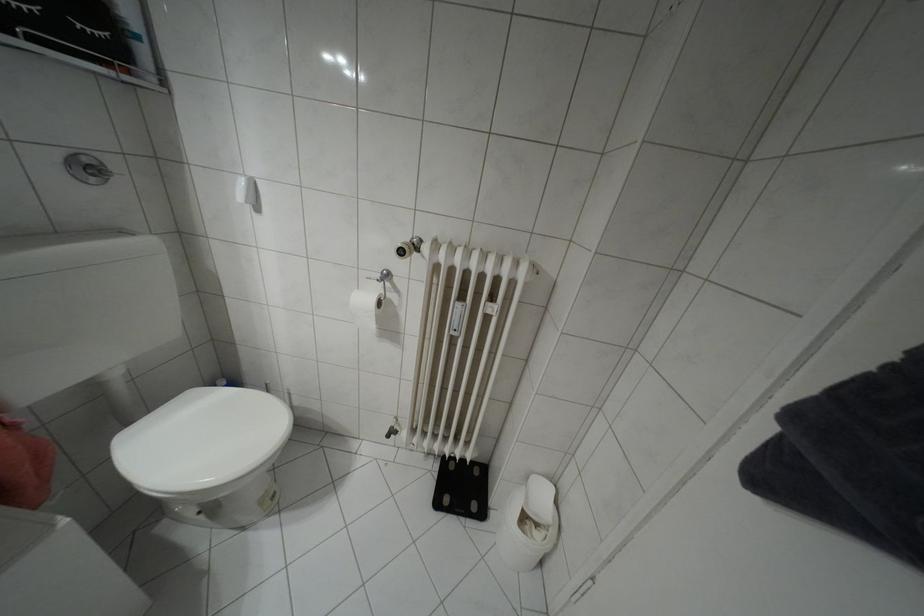
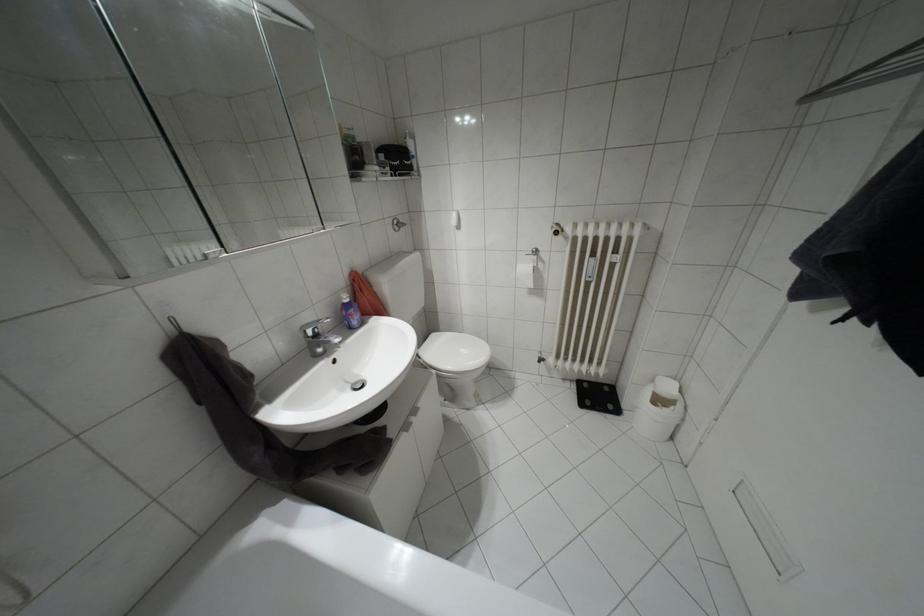
In a continuous first-person perspective shot, in which direction is the camera moving?

The movement direction of the cameraman is left, backward.